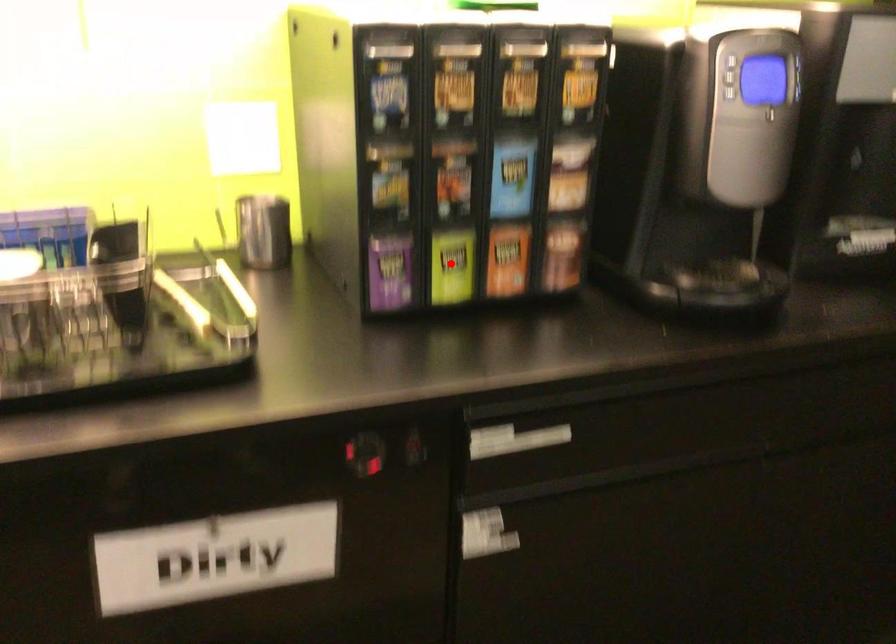
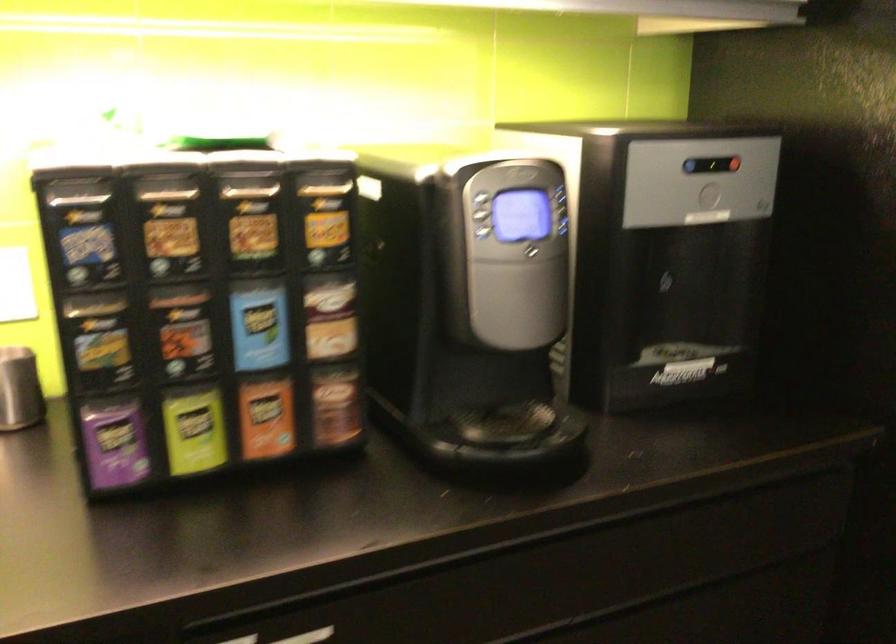
Where in the second image is the point corresponding to the highlighted location from the first image?

(194, 430)